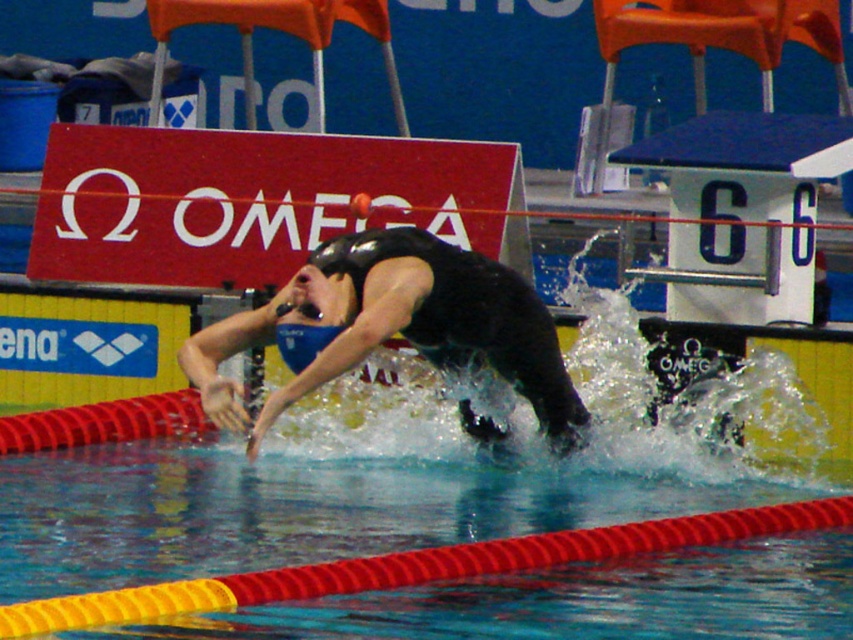
Question: Is smooth rubber pool lane at center above black matte swim cap at center?

Choices:
 (A) no
 (B) yes

Answer: (A)

Question: Among these points, which one is nearest to the camera?

Choices:
 (A) (434, 481)
 (B) (401, 285)

Answer: (B)

Question: Is smooth rubber pool lane at center to the right of black matte swim cap at center from the viewer's perspective?

Choices:
 (A) no
 (B) yes

Answer: (A)

Question: From the image, what is the correct spatial relationship of smooth rubber pool lane at center in relation to black matte swim cap at center?

Choices:
 (A) right
 (B) left

Answer: (B)

Question: Which of the following is the farthest from the observer?

Choices:
 (A) smooth rubber pool lane at center
 (B) black matte swim cap at center

Answer: (B)